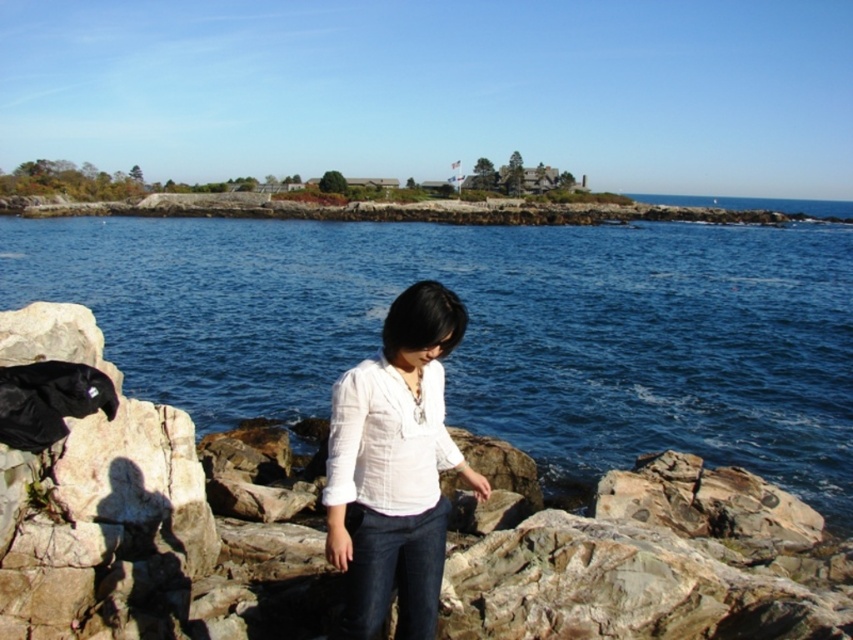
Question: Which point is farther to the camera?

Choices:
 (A) white cotton blouse at center
 (B) blue liquid water at center

Answer: (B)

Question: Is blue liquid water at center to the right of white cotton blouse at center from the viewer's perspective?

Choices:
 (A) yes
 (B) no

Answer: (B)

Question: Which point appears farthest from the camera in this image?

Choices:
 (A) (543, 252)
 (B) (408, 586)

Answer: (A)

Question: Considering the relative positions of blue liquid water at center and white cotton blouse at center in the image provided, where is blue liquid water at center located with respect to white cotton blouse at center?

Choices:
 (A) above
 (B) below

Answer: (A)

Question: Which object appears farthest from the camera in this image?

Choices:
 (A) blue liquid water at center
 (B) white cotton blouse at center

Answer: (A)

Question: Does blue liquid water at center lie behind white cotton blouse at center?

Choices:
 (A) yes
 (B) no

Answer: (A)